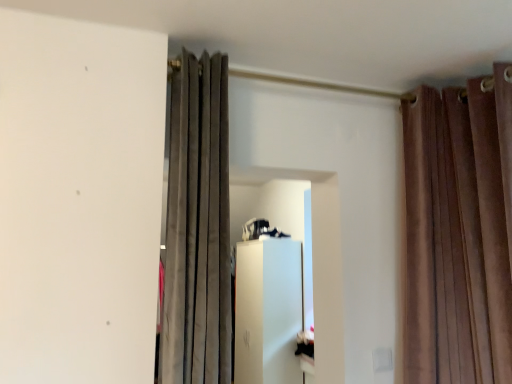
Where is `suede curtain at center, the 1th curtain viewed from the left`? The height and width of the screenshot is (384, 512). suede curtain at center, the 1th curtain viewed from the left is located at coordinates (197, 227).

The image size is (512, 384). What do you see at coordinates (197, 227) in the screenshot? I see `suede curtain at center, which is counted as the second curtain, starting from the right` at bounding box center [197, 227].

Identify the location of brown velvet curtains at upper right, placed as the 2th curtain when sorted from left to right. (458, 232).

Measure the distance between brown velvet curtains at upper right, which is the first curtain from right to left, and camera.

The depth of brown velvet curtains at upper right, which is the first curtain from right to left, is 5.11 feet.

Describe the element at coordinates (458, 232) in the screenshot. I see `brown velvet curtains at upper right, which is the first curtain from right to left` at that location.

The image size is (512, 384). I want to click on suede curtain at center, the 1th curtain viewed from the left, so click(x=197, y=227).

Which object is positioned more to the left, brown velvet curtains at upper right, which is the first curtain from right to left, or suede curtain at center, the 1th curtain viewed from the left?

suede curtain at center, the 1th curtain viewed from the left.

Is the position of brown velvet curtains at upper right, placed as the 2th curtain when sorted from left to right, more distant than that of suede curtain at center, the 1th curtain viewed from the left?

Yes, it is.

Does point (450, 147) appear closer or farther from the camera than point (216, 73)?

Point (450, 147) is farther from the camera than point (216, 73).

From the image's perspective, would you say brown velvet curtains at upper right, placed as the 2th curtain when sorted from left to right, is shown under suede curtain at center, the 1th curtain viewed from the left?

Yes, from the image's perspective, brown velvet curtains at upper right, placed as the 2th curtain when sorted from left to right, is below suede curtain at center, the 1th curtain viewed from the left.

From a real-world perspective, does brown velvet curtains at upper right, which is the first curtain from right to left, stand above suede curtain at center, the 1th curtain viewed from the left?

No, from a real-world perspective, brown velvet curtains at upper right, which is the first curtain from right to left, is not above suede curtain at center, the 1th curtain viewed from the left.

Which object is thinner, brown velvet curtains at upper right, which is the first curtain from right to left, or suede curtain at center, the 1th curtain viewed from the left?

brown velvet curtains at upper right, which is the first curtain from right to left, is thinner.

In terms of height, does brown velvet curtains at upper right, which is the first curtain from right to left, look taller or shorter compared to suede curtain at center, the 1th curtain viewed from the left?

Considering their sizes, brown velvet curtains at upper right, which is the first curtain from right to left, has more height than suede curtain at center, the 1th curtain viewed from the left.

Is brown velvet curtains at upper right, which is the first curtain from right to left, bigger or smaller than suede curtain at center, which is counted as the second curtain, starting from the right?

Clearly, brown velvet curtains at upper right, which is the first curtain from right to left, is smaller in size than suede curtain at center, which is counted as the second curtain, starting from the right.

Is brown velvet curtains at upper right, which is the first curtain from right to left, situated inside suede curtain at center, the 1th curtain viewed from the left, or outside?

brown velvet curtains at upper right, which is the first curtain from right to left, is not enclosed by suede curtain at center, the 1th curtain viewed from the left.

Are brown velvet curtains at upper right, placed as the 2th curtain when sorted from left to right, and suede curtain at center, which is counted as the second curtain, starting from the right, located far from each other?

No, brown velvet curtains at upper right, placed as the 2th curtain when sorted from left to right, is not far away from suede curtain at center, which is counted as the second curtain, starting from the right.

Is brown velvet curtains at upper right, which is the first curtain from right to left, turned away from suede curtain at center, the 1th curtain viewed from the left?

brown velvet curtains at upper right, which is the first curtain from right to left, does not have its back to suede curtain at center, the 1th curtain viewed from the left.

Can you tell me how much brown velvet curtains at upper right, which is the first curtain from right to left, and suede curtain at center, the 1th curtain viewed from the left, differ in facing direction?

There is a 90.5-degree angle between the facing directions of brown velvet curtains at upper right, which is the first curtain from right to left, and suede curtain at center, the 1th curtain viewed from the left.

This screenshot has width=512, height=384. In order to click on curtain located behind the suede curtain at center, the 1th curtain viewed from the left in this screenshot , I will do `click(458, 232)`.

Which object is positioned more to the left, suede curtain at center, which is counted as the second curtain, starting from the right, or brown velvet curtains at upper right, placed as the 2th curtain when sorted from left to right?

Positioned to the left is suede curtain at center, which is counted as the second curtain, starting from the right.

Considering the positions of objects suede curtain at center, the 1th curtain viewed from the left, and brown velvet curtains at upper right, which is the first curtain from right to left, in the image provided, who is in front, suede curtain at center, the 1th curtain viewed from the left, or brown velvet curtains at upper right, which is the first curtain from right to left,?

suede curtain at center, the 1th curtain viewed from the left, is more forward.

Is point (217, 143) closer or farther from the camera than point (472, 212)?

Point (217, 143) appears to be closer to the viewer than point (472, 212).

From the image's perspective, is suede curtain at center, which is counted as the second curtain, starting from the right, under brown velvet curtains at upper right, which is the first curtain from right to left?

No.

From a real-world perspective, is suede curtain at center, which is counted as the second curtain, starting from the right, physically below brown velvet curtains at upper right, placed as the 2th curtain when sorted from left to right?

No, from a real-world perspective, suede curtain at center, which is counted as the second curtain, starting from the right, is not beneath brown velvet curtains at upper right, placed as the 2th curtain when sorted from left to right.

In the scene shown: Can you confirm if suede curtain at center, the 1th curtain viewed from the left, is thinner than brown velvet curtains at upper right, which is the first curtain from right to left?

No.

Which of these two, suede curtain at center, which is counted as the second curtain, starting from the right, or brown velvet curtains at upper right, placed as the 2th curtain when sorted from left to right, stands shorter?

With less height is suede curtain at center, which is counted as the second curtain, starting from the right.

Considering the relative sizes of suede curtain at center, the 1th curtain viewed from the left, and brown velvet curtains at upper right, which is the first curtain from right to left, in the image provided, is suede curtain at center, the 1th curtain viewed from the left, bigger than brown velvet curtains at upper right, which is the first curtain from right to left,?

Yes, suede curtain at center, the 1th curtain viewed from the left, is bigger than brown velvet curtains at upper right, which is the first curtain from right to left.

Is suede curtain at center, which is counted as the second curtain, starting from the right, surrounding brown velvet curtains at upper right, placed as the 2th curtain when sorted from left to right?

No, brown velvet curtains at upper right, placed as the 2th curtain when sorted from left to right, is not a part of suede curtain at center, which is counted as the second curtain, starting from the right.

Can you see suede curtain at center, which is counted as the second curtain, starting from the right, touching brown velvet curtains at upper right, placed as the 2th curtain when sorted from left to right?

They are not placed beside each other.

Is suede curtain at center, which is counted as the second curtain, starting from the right, looking in the opposite direction of brown velvet curtains at upper right, which is the first curtain from right to left?

suede curtain at center, which is counted as the second curtain, starting from the right, does not have its back to brown velvet curtains at upper right, which is the first curtain from right to left.

Can you tell me how much suede curtain at center, the 1th curtain viewed from the left, and brown velvet curtains at upper right, which is the first curtain from right to left, differ in facing direction?

90.5 degrees separate the facing orientations of suede curtain at center, the 1th curtain viewed from the left, and brown velvet curtains at upper right, which is the first curtain from right to left.

Could you measure the distance between suede curtain at center, which is counted as the second curtain, starting from the right, and brown velvet curtains at upper right, placed as the 2th curtain when sorted from left to right?

suede curtain at center, which is counted as the second curtain, starting from the right, and brown velvet curtains at upper right, placed as the 2th curtain when sorted from left to right, are 36.96 inches apart.

This screenshot has height=384, width=512. There is a brown velvet curtains at upper right, placed as the 2th curtain when sorted from left to right. Find the location of `curtain above it (from a real-world perspective)`. curtain above it (from a real-world perspective) is located at coordinates (197, 227).

Where is `curtain above the brown velvet curtains at upper right, which is the first curtain from right to left (from the image's perspective)`? curtain above the brown velvet curtains at upper right, which is the first curtain from right to left (from the image's perspective) is located at coordinates 197,227.

What are the coordinates of `curtain above the brown velvet curtains at upper right, placed as the 2th curtain when sorted from left to right (from a real-world perspective)` in the screenshot? It's located at (x=197, y=227).